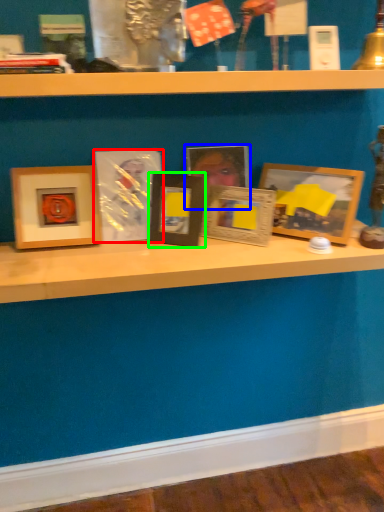
Question: Based on their relative distances, which object is nearer to picture frame (highlighted by a red box)? Choose from picture frame (highlighted by a blue box) and picture frame (highlighted by a green box).

Choices:
 (A) picture frame
 (B) picture frame

Answer: (B)